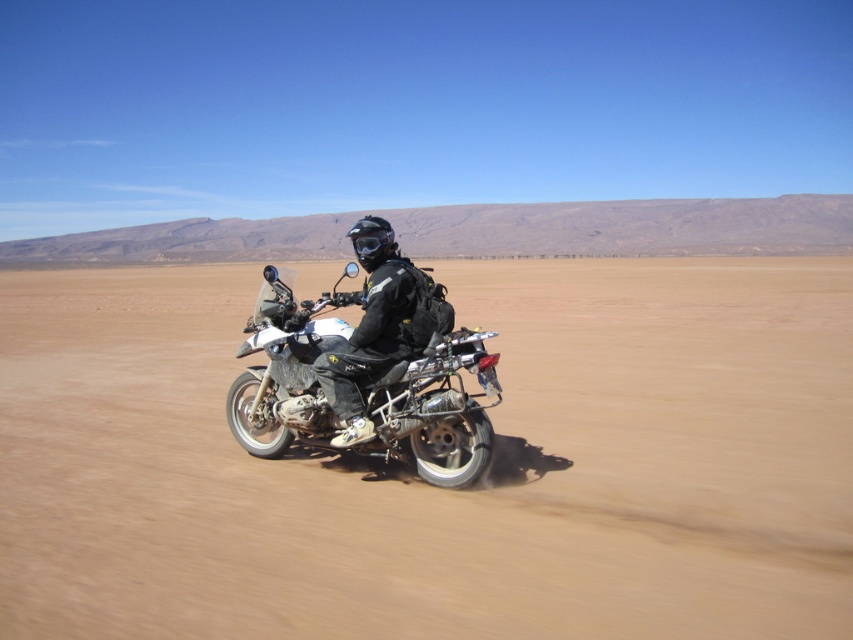
Does point (463, 444) come behind point (390, 246)?

No, it is not.

In the scene shown: Between matte black motorcycle at center and black matte helmet at center, which one appears on the right side from the viewer's perspective?

black matte helmet at center

Find the location of a particular element. matte black motorcycle at center is located at coordinates (367, 376).

Looking at this image, does matte black motorcycle at center have a larger size compared to clear plastic goggles at center?

Correct, matte black motorcycle at center is larger in size than clear plastic goggles at center.

Is point (270, 308) farther from camera compared to point (364, 260)?

Yes, point (270, 308) is farther from viewer.

Image resolution: width=853 pixels, height=640 pixels. What do you see at coordinates (367, 376) in the screenshot?
I see `matte black motorcycle at center` at bounding box center [367, 376].

The width and height of the screenshot is (853, 640). I want to click on matte black motorcycle at center, so click(x=367, y=376).

Is brown sandy terrain at center above matte black motorcycle at center?

Indeed, brown sandy terrain at center is positioned over matte black motorcycle at center.

Measure the distance from brown sandy terrain at center to matte black motorcycle at center.

They are 5.17 meters apart.

Is point (558, 276) behind point (457, 488)?

Yes, point (558, 276) is farther from viewer.

Locate an element on the screen. brown sandy terrain at center is located at coordinates (434, 488).